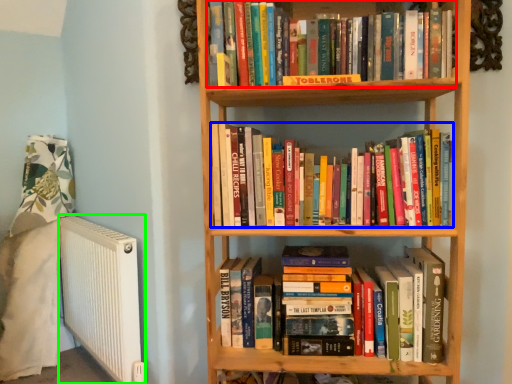
Question: Which object is the farthest from book (highlighted by a red box)? Choose among these: book (highlighted by a blue box) or radiator (highlighted by a green box).

Choices:
 (A) book
 (B) radiator

Answer: (B)